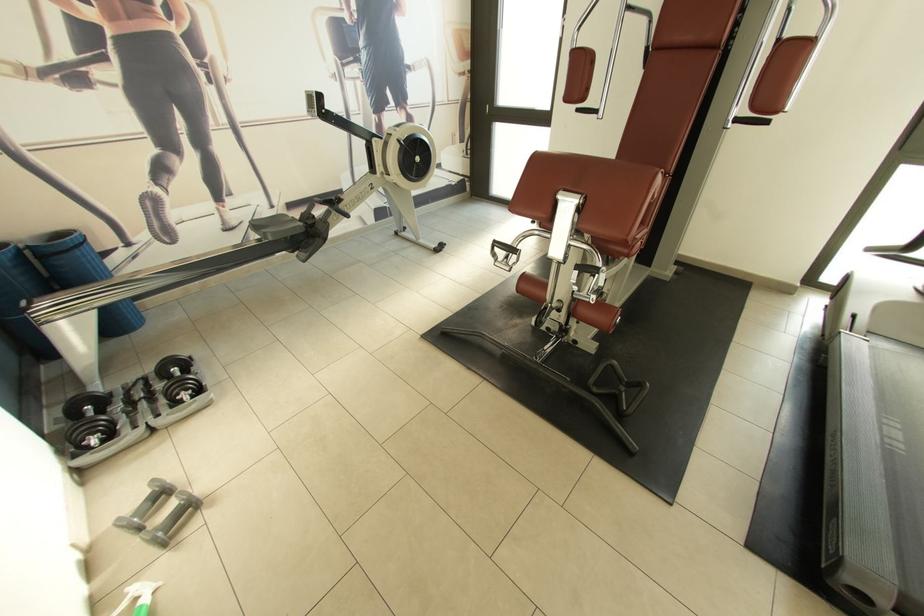
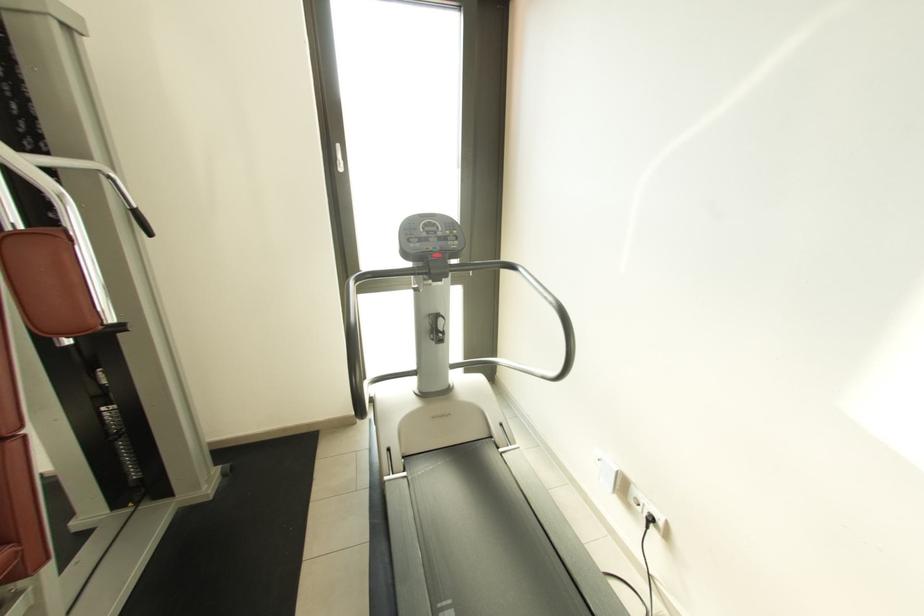
The point at (x=896, y=418) is marked in the first image. Where is the corresponding point in the second image?

(450, 605)